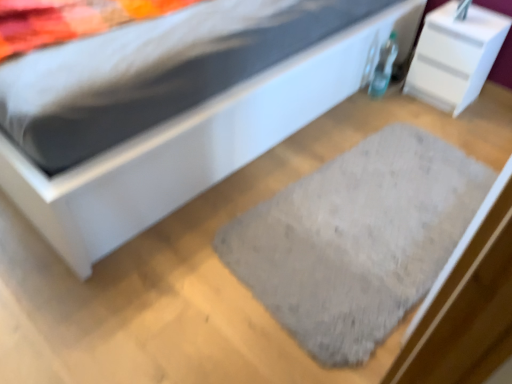
Question: Can you confirm if white glossy nightstand at upper right is positioned to the right of white matte bed at center?

Choices:
 (A) no
 (B) yes

Answer: (B)

Question: Can you confirm if white glossy nightstand at upper right is thinner than white matte bed at center?

Choices:
 (A) no
 (B) yes

Answer: (B)

Question: Does white glossy nightstand at upper right contain white matte bed at center?

Choices:
 (A) yes
 (B) no

Answer: (B)

Question: Is white glossy nightstand at upper right further to the viewer compared to white matte bed at center?

Choices:
 (A) yes
 (B) no

Answer: (A)

Question: From a real-world perspective, is white glossy nightstand at upper right below white matte bed at center?

Choices:
 (A) yes
 (B) no

Answer: (B)

Question: Considering the positions of white matte bed at center and gray fuzzy rug at center in the image, is white matte bed at center bigger or smaller than gray fuzzy rug at center?

Choices:
 (A) small
 (B) big

Answer: (B)

Question: Based on their positions, is white matte bed at center located to the left or right of gray fuzzy rug at center?

Choices:
 (A) right
 (B) left

Answer: (B)

Question: From a real-world perspective, relative to gray fuzzy rug at center, is white matte bed at center vertically above or below?

Choices:
 (A) above
 (B) below

Answer: (B)

Question: Is white matte bed at center spatially inside gray fuzzy rug at center, or outside of it?

Choices:
 (A) inside
 (B) outside

Answer: (B)

Question: From the image's perspective, is gray fuzzy rug at center above or below white glossy nightstand at upper right?

Choices:
 (A) above
 (B) below

Answer: (B)

Question: Is gray fuzzy rug at center inside the boundaries of white glossy nightstand at upper right, or outside?

Choices:
 (A) inside
 (B) outside

Answer: (B)

Question: Does point (360, 183) appear closer or farther from the camera than point (494, 23)?

Choices:
 (A) closer
 (B) farther

Answer: (A)

Question: From their relative heights in the image, would you say gray fuzzy rug at center is taller or shorter than white glossy nightstand at upper right?

Choices:
 (A) tall
 (B) short

Answer: (B)

Question: Is point (471, 8) closer or farther from the camera than point (174, 142)?

Choices:
 (A) farther
 (B) closer

Answer: (A)

Question: From the image's perspective, relative to white matte bed at center, is white glossy nightstand at upper right above or below?

Choices:
 (A) above
 (B) below

Answer: (A)